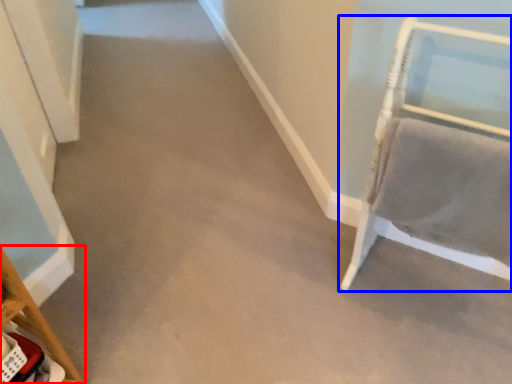
Question: Among these objects, which one is nearest to the camera, furniture (highlighted by a red box) or furniture (highlighted by a blue box)?

Choices:
 (A) furniture
 (B) furniture

Answer: (B)